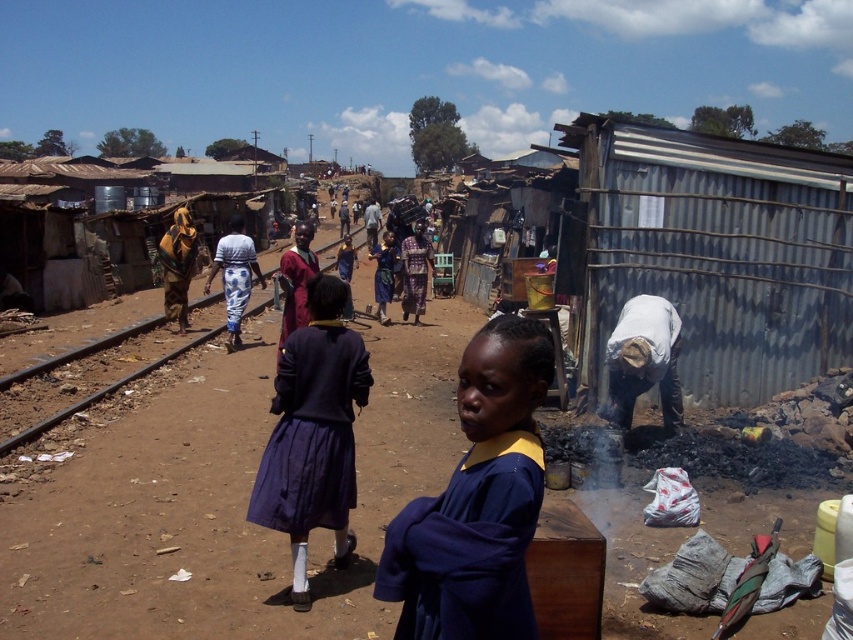
Question: Can you confirm if blue uniform at center is positioned to the right of dark purple fabric skirt at center?

Choices:
 (A) no
 (B) yes

Answer: (B)

Question: Which is farther from the white cloth at lower right?

Choices:
 (A) matte brown dress at left
 (B) blue uniform at center

Answer: (A)

Question: Estimate the real-world distances between objects in this image. Which object is farther from the matte brown dress at left?

Choices:
 (A) patterned fabric dress at center
 (B) blue printed dress at center
 (C) blue uniform at center

Answer: (C)

Question: Does white cloth at lower right lie behind matte brown dress at left?

Choices:
 (A) no
 (B) yes

Answer: (A)

Question: Estimate the real-world distances between objects in this image. Which object is farther from the patterned fabric dress at center?

Choices:
 (A) blue printed dress at center
 (B) white cloth at lower right
 (C) matte brown dress at left
 (D) dark purple fabric skirt at center

Answer: (D)

Question: Does dark purple fabric skirt at center appear on the right side of patterned fabric dress at center?

Choices:
 (A) yes
 (B) no

Answer: (B)